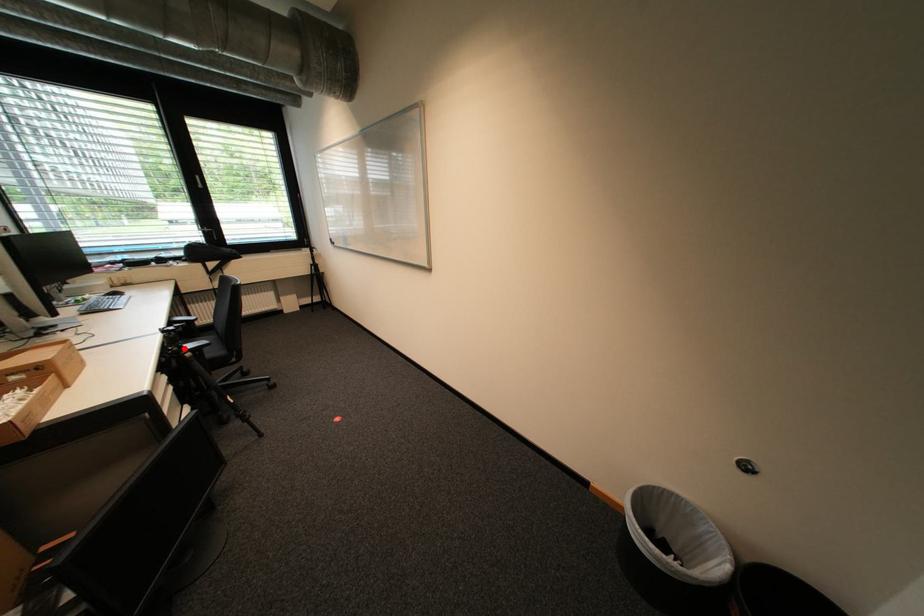
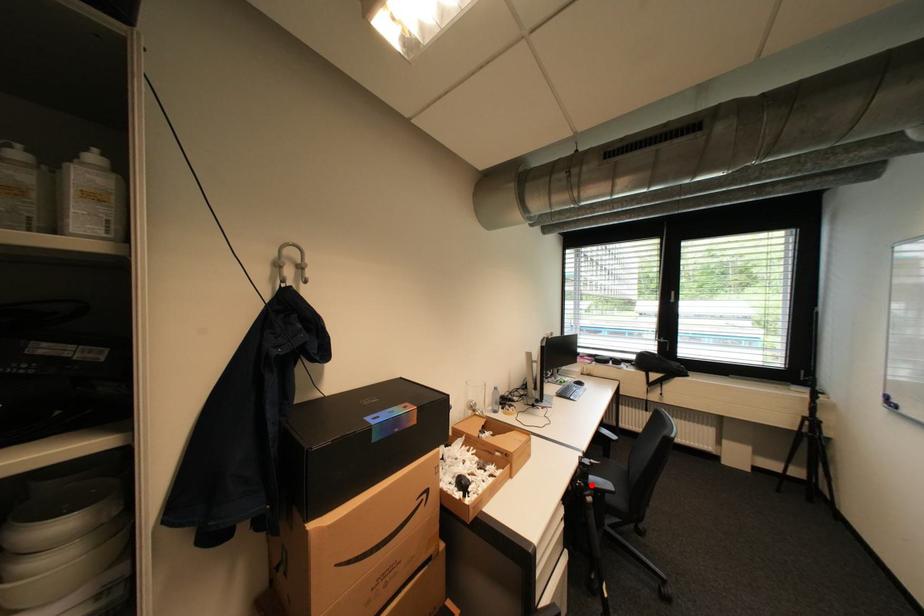
I am providing you with two images of the same scene from different viewpoints. A red point is marked on the first image and another point is marked on the second image. Is the marked point in image1 the same physical position as the marked point in image2?

Yes